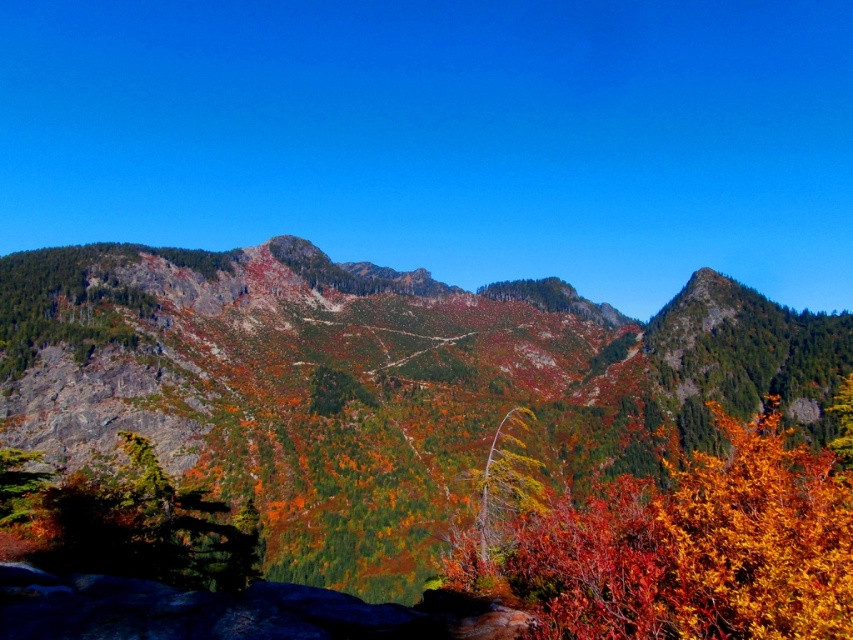
Does rocky cliff face at center have a lesser height compared to shiny orange leaves at center?

No.

Describe the element at coordinates (376, 384) in the screenshot. The width and height of the screenshot is (853, 640). I see `rocky cliff face at center` at that location.

This screenshot has width=853, height=640. What do you see at coordinates (376, 384) in the screenshot? I see `rocky cliff face at center` at bounding box center [376, 384].

Locate an element on the screen. The height and width of the screenshot is (640, 853). rocky cliff face at center is located at coordinates (376, 384).

Is shiny orange leaves at center thinner than green textured tree at lower left?

No.

Can you confirm if shiny orange leaves at center is shorter than green textured tree at lower left?

No, shiny orange leaves at center is not shorter than green textured tree at lower left.

Which is in front, point (480, 576) or point (218, 564)?

Positioned in front is point (480, 576).

The height and width of the screenshot is (640, 853). In order to click on shiny orange leaves at center in this screenshot , I will do `click(701, 545)`.

Is rocky cliff face at center behind green textured tree at lower left?

Yes.

Is point (196, 346) positioned behind point (177, 512)?

Yes, it is.

At what (x,y) coordinates should I click in order to perform the action: click on rocky cliff face at center. Please return your answer as a coordinate pair (x, y). The width and height of the screenshot is (853, 640). Looking at the image, I should click on (376, 384).